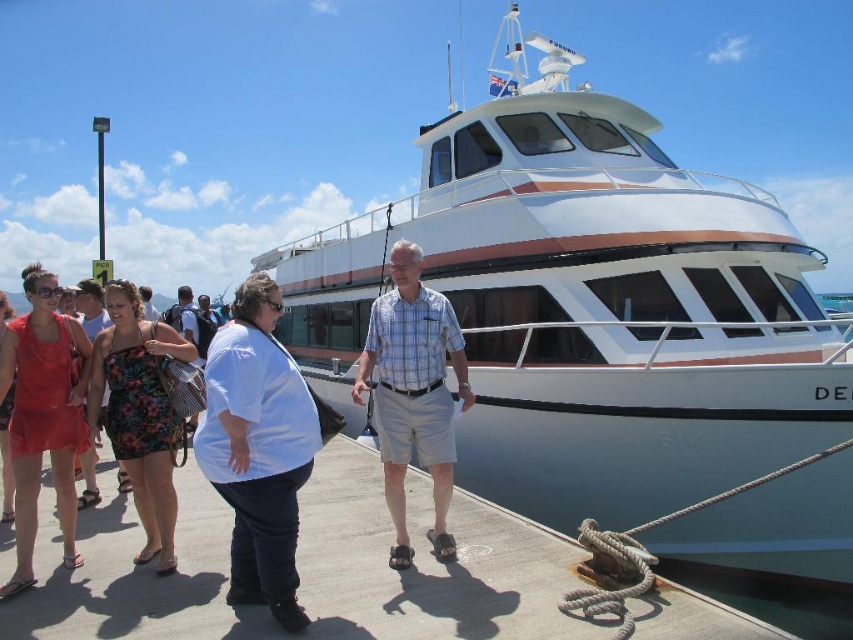
Question: Which of the following is the farthest from the observer?

Choices:
 (A) (309, 422)
 (B) (451, 317)
 (C) (639, 516)

Answer: (C)

Question: Which point is farther to the camera?

Choices:
 (A) (96, 346)
 (B) (265, 276)
 (C) (57, 314)
 (D) (811, 380)

Answer: (C)

Question: Is white glossy boat at center smaller than white matte shirt at center?

Choices:
 (A) no
 (B) yes

Answer: (A)

Question: Considering the relative positions of plaid shirt at center and matte red dress at lower left in the image provided, where is plaid shirt at center located with respect to matte red dress at lower left?

Choices:
 (A) below
 (B) above

Answer: (B)

Question: Is white matte shirt at center smaller than plaid shirt at center?

Choices:
 (A) no
 (B) yes

Answer: (B)

Question: Which is nearer to the matte red dress at lower left?

Choices:
 (A) white glossy boat at center
 (B) white matte shirt at center
 (C) plaid shirt at center

Answer: (B)